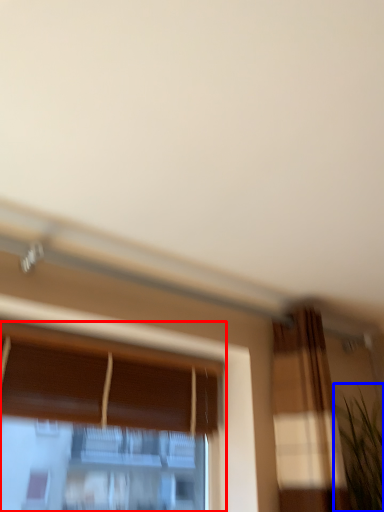
Question: Which point is further to the camera, window (highlighted by a red box) or plant (highlighted by a blue box)?

Choices:
 (A) window
 (B) plant

Answer: (B)